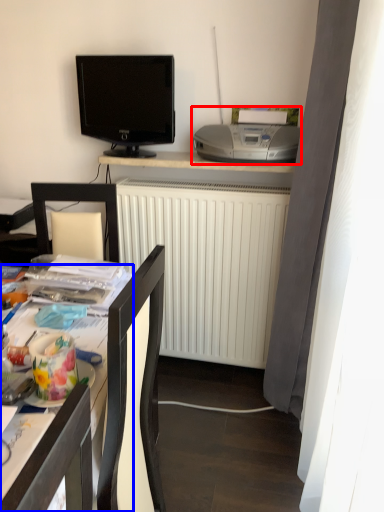
Question: Which object is further to the camera taking this photo, printer (highlighted by a red box) or desk (highlighted by a blue box)?

Choices:
 (A) printer
 (B) desk

Answer: (A)